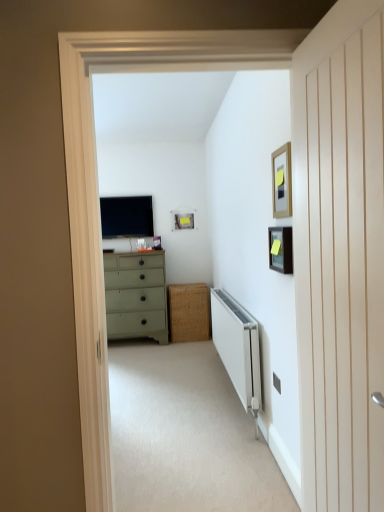
Question: In terms of height, does beige carpet at center look taller or shorter compared to white wood door at right?

Choices:
 (A) tall
 (B) short

Answer: (B)

Question: Is beige carpet at center situated inside white wood door at right or outside?

Choices:
 (A) outside
 (B) inside

Answer: (A)

Question: Estimate the real-world distances between objects in this image. Which object is closer to the wooden picture frame at upper right, which appears as the 3th picture frame when viewed from the left?

Choices:
 (A) white metallic radiator at lower center
 (B) light green painted wood chest of drawers at center
 (C) matte black picture frame at upper center, which ranks as the third picture frame in front-to-back order
 (D) matte black tv at center
 (E) white wood door at right

Answer: (E)

Question: Estimate the real-world distances between objects in this image. Which object is closer to the beige carpet at center?

Choices:
 (A) wooden picture frame at upper right, positioned as the 1th picture frame in front-to-back order
 (B) matte black tv at center
 (C) matte black picture frame at upper right, the 2th picture frame in the back-to-front sequence
 (D) white wood door at right
 (E) light green painted wood chest of drawers at center

Answer: (C)